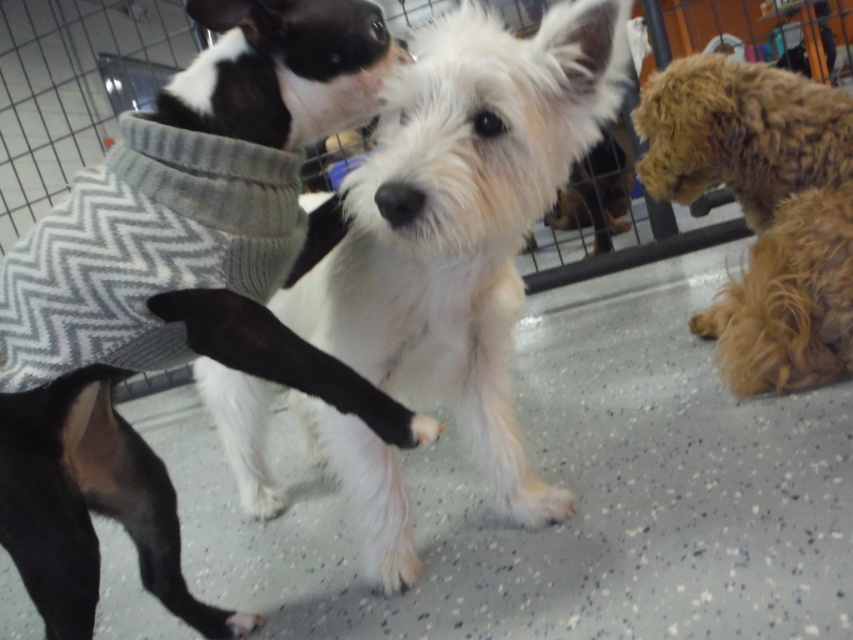
From the picture: You are a visitor observing the dogs in the enclosure. Which dog is positioned lower in the image, the white fluffy dog at center or the fuzzy brown dog at right?

The white fluffy dog at center is positioned lower than the fuzzy brown dog at right in the image.

You are a visitor observing the dogs in the enclosure. Which dog is closer to you, the black and white sweater at upper left or the white fluffy dog at center?

The black and white sweater at upper left is closer to you because the white fluffy dog at center is behind it.

You are a service robot in a pet care facility. You need to approach the white fluffy dog at center to administer a treat. Given that your maximum reach distance is 36 inches, will you be able to reach the dog without moving closer?

The white fluffy dog at center is 39.24 inches away from the viewer. Since your maximum reach is 36 inches, you cannot reach the dog without moving closer.